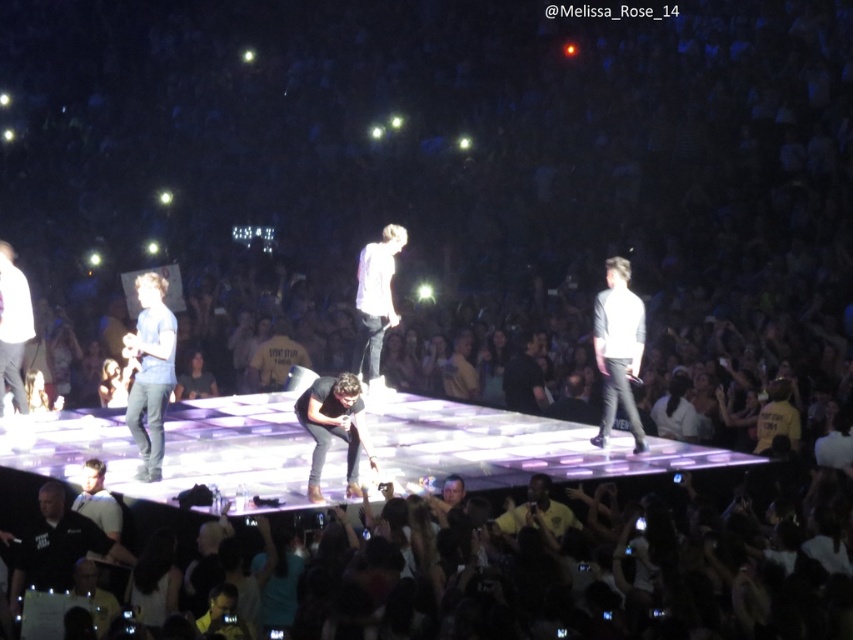
Consider the image. Is matte blue shirt at left below black matte shirt at center?

No.

Can you confirm if matte blue shirt at left is bigger than black matte shirt at center?

No.

Between point (167, 324) and point (535, 392), which one is positioned behind?

The point (535, 392) is behind.

Where is `matte blue shirt at left`? This screenshot has height=640, width=853. matte blue shirt at left is located at coordinates (149, 371).

Does white matte shirt at right come in front of black shirt at lower left?

No, white matte shirt at right is behind black shirt at lower left.

Consider the image. Measure the distance between point (602,401) and camera.

They are 59.48 feet apart.

Which is behind, point (630, 356) or point (38, 545)?

The point (630, 356) is more distant.

This screenshot has width=853, height=640. I want to click on white matte shirt at right, so click(618, 348).

Does white matte shirt at center appear over black matte shirt at center?

Yes, white matte shirt at center is above black matte shirt at center.

Consider the image. Which is more to the right, white matte shirt at center or black matte shirt at center?

black matte shirt at center is more to the right.

This screenshot has width=853, height=640. Identify the location of white matte shirt at center. (375, 301).

This screenshot has width=853, height=640. Find the location of `white matte shirt at center`. white matte shirt at center is located at coordinates (375, 301).